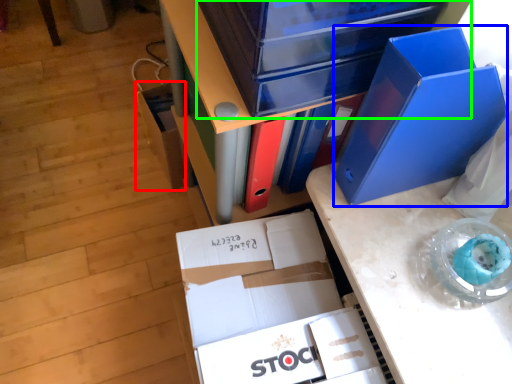
Question: Based on their relative distances, which object is farther from storage box (highlighted by a red box)? Choose from paperback book (highlighted by a blue box) and storage box (highlighted by a green box).

Choices:
 (A) paperback book
 (B) storage box

Answer: (A)